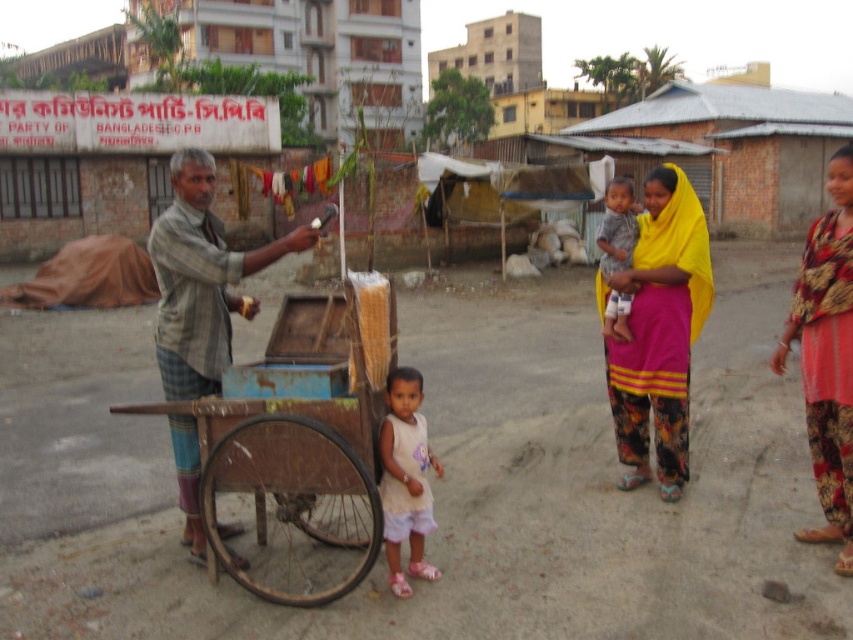
Can you confirm if rusty wood cart at center is positioned to the right of yellow fabric baby at center?

In fact, rusty wood cart at center is to the left of yellow fabric baby at center.

What do you see at coordinates (299, 442) in the screenshot?
I see `rusty wood cart at center` at bounding box center [299, 442].

Is point (328, 444) positioned in front of point (613, 252)?

Yes.

Identify the location of rusty wood cart at center. (299, 442).

Is rusty wood cart at center in front of white cotton dress at center?

Yes, rusty wood cart at center is in front of white cotton dress at center.

Does rusty wood cart at center appear on the right side of white cotton dress at center?

Incorrect, rusty wood cart at center is not on the right side of white cotton dress at center.

This screenshot has width=853, height=640. Identify the location of rusty wood cart at center. (299, 442).

Is rusty wood cart at center to the right of floral fabric dress at right from the viewer's perspective?

No, rusty wood cart at center is not to the right of floral fabric dress at right.

Is rusty wood cart at center shorter than floral fabric dress at right?

Yes.

Describe the element at coordinates (299, 442) in the screenshot. I see `rusty wood cart at center` at that location.

This screenshot has width=853, height=640. I want to click on rusty wood cart at center, so click(x=299, y=442).